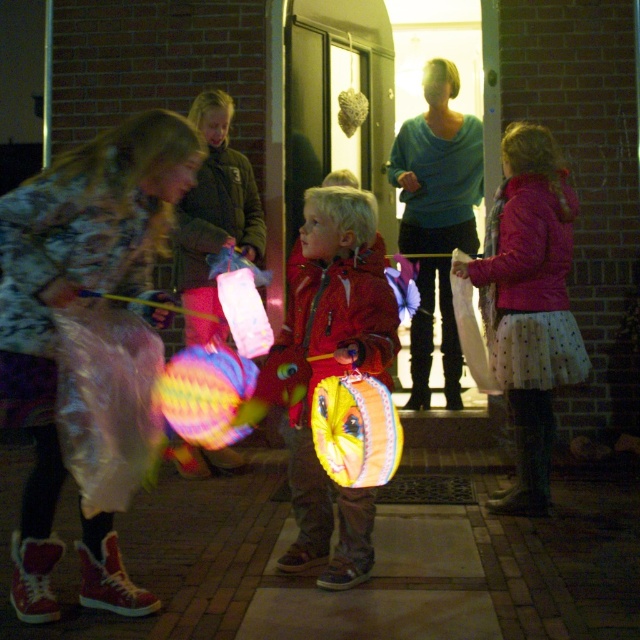
You are a photographer trying to capture a photo of the shiny red jacket at center and the polka dot skirt at center. Since you want to ensure both are fully visible, which object should you focus on first to avoid blurring due to their height difference?

The shiny red jacket at center is shorter than the polka dot skirt at center, so you should focus on the shiny red jacket at center first to ensure it is in clear view before adjusting for the taller skirt.

You are a photographer trying to capture a photo of the shiny red jacket at center and the polka dot skirt at center. Which object should you focus on first if you want to ensure both are in sharp focus?

The shiny red jacket at center is positioned under the polka dot skirt at center. Since the jacket is lower, you should focus on the polka dot skirt at center first to ensure both are in sharp focus as the depth of field might capture the lower jacket naturally.